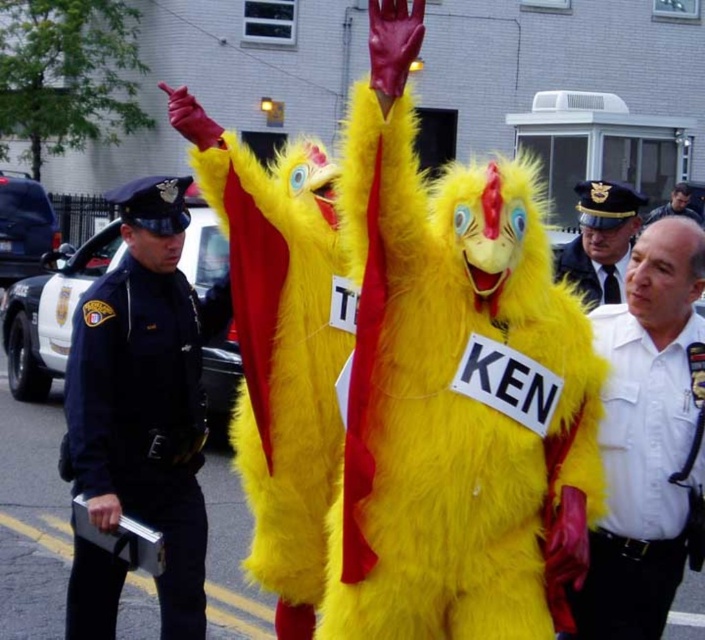
Who is positioned more to the left, navy blue uniform at left or white uniform shirt at center?

Positioned to the left is navy blue uniform at left.

What do you see at coordinates (147, 394) in the screenshot? The width and height of the screenshot is (705, 640). I see `navy blue uniform at left` at bounding box center [147, 394].

Image resolution: width=705 pixels, height=640 pixels. Find the location of `navy blue uniform at left`. navy blue uniform at left is located at coordinates (147, 394).

Between point (106, 506) and point (673, 196), which one is positioned behind?

The point (673, 196) is behind.

From the picture: Does navy blue uniform at left have a smaller size compared to smooth black hair at center?

Yes.

The image size is (705, 640). In order to click on navy blue uniform at left in this screenshot , I will do point(147,394).

Which is more to the right, white uniform shirt at center or white uniform at center?

Positioned to the right is white uniform at center.

Does white uniform shirt at center appear over white uniform at center?

No, white uniform shirt at center is not above white uniform at center.

Between point (594, 314) and point (613, 198), which one is positioned behind?

The point (613, 198) is behind.

Identify the location of white uniform shirt at center. (646, 435).